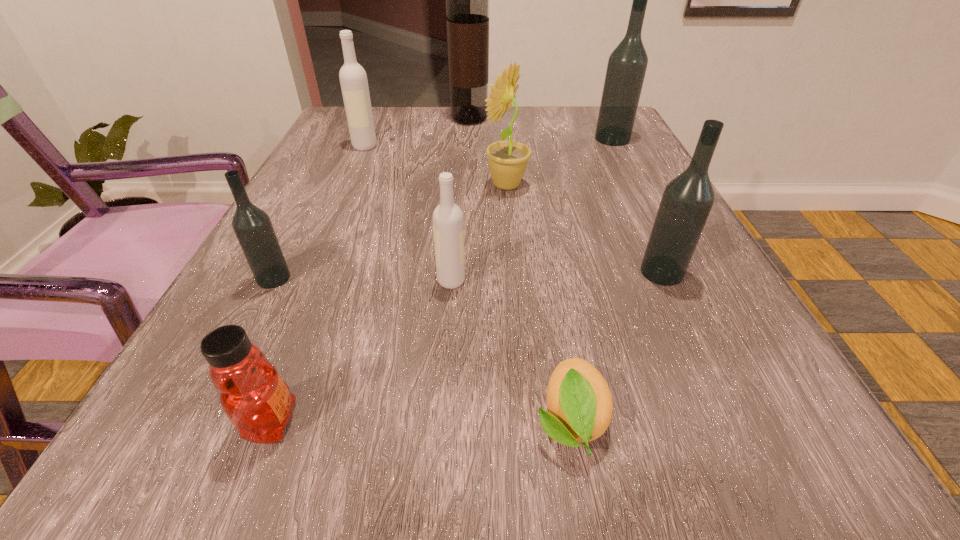
This screenshot has height=540, width=960. Identify the location of free space between the wine bottle and the biggest black vodka. (540, 129).

Find the location of a particular element. This screenshot has width=960, height=540. unoccupied area between the farthest object and the second smallest black vodka is located at coordinates (565, 195).

I want to click on blank region between the second smallest black vodka and the sunflower, so click(584, 228).

The image size is (960, 540). Find the location of `unoccupied position between the farther white vodka and the second smallest black vodka`. unoccupied position between the farther white vodka and the second smallest black vodka is located at coordinates (514, 209).

The width and height of the screenshot is (960, 540). Find the location of `free space between the second shortest object and the second biggest black vodka`. free space between the second shortest object and the second biggest black vodka is located at coordinates (467, 347).

This screenshot has width=960, height=540. I want to click on empty location between the shortest object and the farthest black vodka, so click(x=591, y=280).

Where is `free space between the sixth nearest object and the second biggest black vodka`? This screenshot has width=960, height=540. free space between the sixth nearest object and the second biggest black vodka is located at coordinates (584, 228).

Locate an element on the screen. object that stands as the second closest to the tallest object is located at coordinates (508, 160).

Identify the location of the fifth closest object to the second biggest black vodka. (254, 397).

You are a GUI agent. You are given a task and a screenshot of the screen. Output one action in this format:
    pyautogui.click(x=<x>, y=<y>)
    Task: Click on the vodka that is the closest to the farther white vodka
    
    Given the screenshot: What is the action you would take?
    pyautogui.click(x=252, y=226)